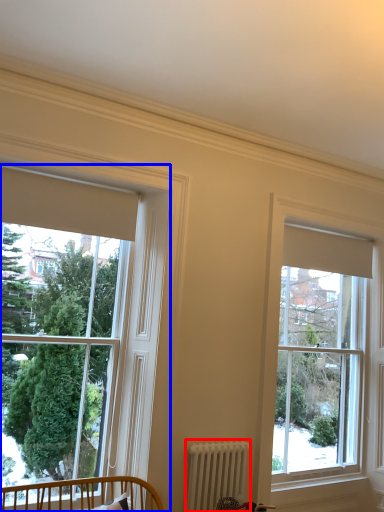
Question: Which object is further to the camera taking this photo, radiator (highlighted by a red box) or window (highlighted by a blue box)?

Choices:
 (A) radiator
 (B) window

Answer: (A)